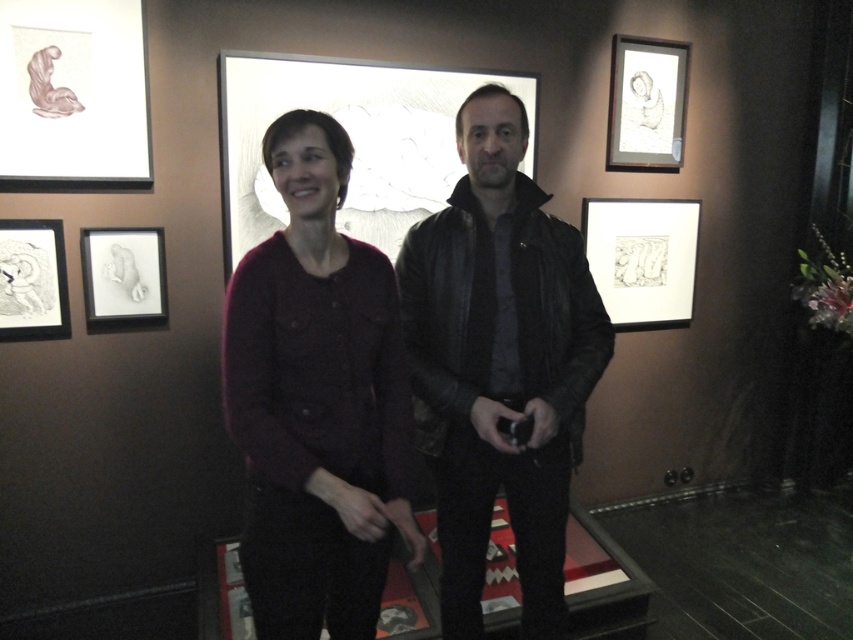
Consider the image. Between black matte picture frame at lower right and matte black picture frame at upper right, which one is positioned higher?

matte black picture frame at upper right is higher up.

Is black matte picture frame at lower right below matte black picture frame at upper right?

Yes, black matte picture frame at lower right is below matte black picture frame at upper right.

Who is more distant from viewer, (x=682, y=282) or (x=631, y=109)?

The point (x=682, y=282) is behind.

In order to click on black matte picture frame at lower right in this screenshot , I will do `click(642, 259)`.

Does matte purple sweater at center appear on the left side of matte paper drawing at upper left?

No, matte purple sweater at center is not to the left of matte paper drawing at upper left.

Who is more distant from viewer, (309, 374) or (108, 97)?

The point (108, 97) is more distant.

Between point (300, 404) and point (16, 81), which one is positioned in front?

Positioned in front is point (300, 404).

Identify the location of matte purple sweater at center. (317, 401).

Is black paper drawing at left above white paper drawing at left?

Actually, black paper drawing at left is below white paper drawing at left.

Does point (41, 244) come in front of point (157, 320)?

Yes, point (41, 244) is in front of point (157, 320).

Which is behind, point (55, 256) or point (84, 273)?

Point (84, 273)

At what (x,y) coordinates should I click in order to perform the action: click on black paper drawing at left. Please return your answer as a coordinate pair (x, y). This screenshot has width=853, height=640. Looking at the image, I should click on (32, 280).